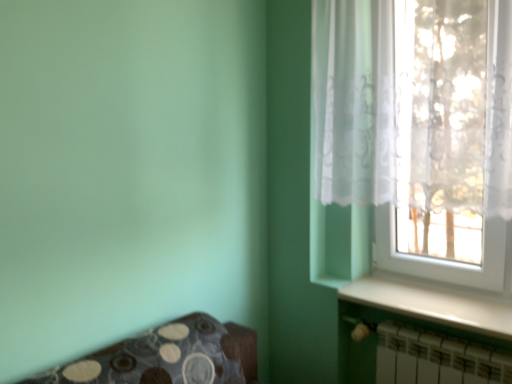
Measure the distance between point [418,302] and camera.

A distance of 5.52 feet exists between point [418,302] and camera.

What do you see at coordinates (418, 130) in the screenshot? This screenshot has width=512, height=384. I see `translucent fabric at upper right` at bounding box center [418, 130].

Locate an element on the screen. The width and height of the screenshot is (512, 384). white metallic radiator at lower right is located at coordinates (436, 359).

You are a GUI agent. You are given a task and a screenshot of the screen. Output one action in this format:
    pyautogui.click(x=<x>, y=<y>)
    Task: Click on the white glossy window sill at lower right
    The image size is (512, 384).
    Given the screenshot: What is the action you would take?
    pyautogui.click(x=434, y=302)

Which object is thinner, white glossy window sill at lower right or translucent fabric at upper right?

Thinner between the two is translucent fabric at upper right.

How distant is white glossy window sill at lower right from translucent fabric at upper right?

The distance of white glossy window sill at lower right from translucent fabric at upper right is 17.13 inches.

Locate an element on the screen. window lying in front of the white glossy window sill at lower right is located at coordinates (418, 130).

Is white glossy window sill at lower right facing towards translucent fabric at upper right?

No, white glossy window sill at lower right does not turn towards translucent fabric at upper right.

Does translucent fabric at upper right have a larger size compared to white glossy window sill at lower right?

Indeed, translucent fabric at upper right has a larger size compared to white glossy window sill at lower right.

Between translucent fabric at upper right and white glossy window sill at lower right, which one has more height?

translucent fabric at upper right.

Which object is wider, translucent fabric at upper right or white glossy window sill at lower right?

With larger width is white glossy window sill at lower right.

Locate an element on the screen. This screenshot has height=384, width=512. window sill beneath the translucent fabric at upper right (from a real-world perspective) is located at coordinates (434, 302).

Which object is thinner, white metallic radiator at lower right or white glossy window sill at lower right?

white metallic radiator at lower right.

Considering the sizes of objects white metallic radiator at lower right and white glossy window sill at lower right in the image provided, who is shorter, white metallic radiator at lower right or white glossy window sill at lower right?

Standing shorter between the two is white glossy window sill at lower right.

Which point is more forward, (x=393, y=349) or (x=421, y=315)?

The point (x=421, y=315) is closer to the camera.

Which of these two, translucent fabric at upper right or white metallic radiator at lower right, stands taller?

translucent fabric at upper right is taller.

Consider the image. From a real-world perspective, between translucent fabric at upper right and white metallic radiator at lower right, who is vertically higher?

From a 3D spatial view, translucent fabric at upper right is above.

Considering the sizes of translucent fabric at upper right and white metallic radiator at lower right in the image, is translucent fabric at upper right bigger or smaller than white metallic radiator at lower right?

Clearly, translucent fabric at upper right is larger in size than white metallic radiator at lower right.

Would you say translucent fabric at upper right is to the left or to the right of white metallic radiator at lower right in the picture?

translucent fabric at upper right is to the left of white metallic radiator at lower right.

Would you say translucent fabric at upper right is part of white metallic radiator at lower right's contents?

No, translucent fabric at upper right is not surrounded by white metallic radiator at lower right.

In the image, is white metallic radiator at lower right positioned in front of or behind translucent fabric at upper right?

In the image, white metallic radiator at lower right appears behind translucent fabric at upper right.

Between white metallic radiator at lower right and translucent fabric at upper right, which one has larger size?

translucent fabric at upper right.

How different are the orientations of white metallic radiator at lower right and translucent fabric at upper right in degrees?

1.25 degrees.

Is white glossy window sill at lower right positioned with its back to white metallic radiator at lower right?

That's not correct — white glossy window sill at lower right is not looking away from white metallic radiator at lower right.

From the image's perspective, is white glossy window sill at lower right above white metallic radiator at lower right?

Correct, white glossy window sill at lower right appears higher than white metallic radiator at lower right in the image.

Does white glossy window sill at lower right have a greater height compared to white metallic radiator at lower right?

In fact, white glossy window sill at lower right may be shorter than white metallic radiator at lower right.

From a real-world perspective, which is physically above, white glossy window sill at lower right or white metallic radiator at lower right?

In real-world perspective, white glossy window sill at lower right is above.

The height and width of the screenshot is (384, 512). I want to click on window sill below the translucent fabric at upper right (from the image's perspective), so click(x=434, y=302).

The image size is (512, 384). I want to click on window in front of the white glossy window sill at lower right, so click(x=418, y=130).

Based on their spatial positions, is translucent fabric at upper right or white glossy window sill at lower right further from white metallic radiator at lower right?

translucent fabric at upper right is further to white metallic radiator at lower right.

Estimate the real-world distances between objects in this image. Which object is further from white glossy window sill at lower right, white metallic radiator at lower right or translucent fabric at upper right?

translucent fabric at upper right is positioned further to the anchor white glossy window sill at lower right.

Estimate the real-world distances between objects in this image. Which object is closer to white glossy window sill at lower right, translucent fabric at upper right or white metallic radiator at lower right?

white metallic radiator at lower right is positioned closer to the anchor white glossy window sill at lower right.

Which object lies nearer to the anchor point translucent fabric at upper right, white metallic radiator at lower right or white glossy window sill at lower right?

The object closer to translucent fabric at upper right is white glossy window sill at lower right.

When comparing their distances from translucent fabric at upper right, does white glossy window sill at lower right or white metallic radiator at lower right seem further?

white metallic radiator at lower right lies further to translucent fabric at upper right than the other object.

Based on their spatial positions, is white glossy window sill at lower right or translucent fabric at upper right closer to white metallic radiator at lower right?

Based on the image, white glossy window sill at lower right appears to be nearer to white metallic radiator at lower right.

This screenshot has height=384, width=512. I want to click on window sill between translucent fabric at upper right and white metallic radiator at lower right from top to bottom, so click(434, 302).